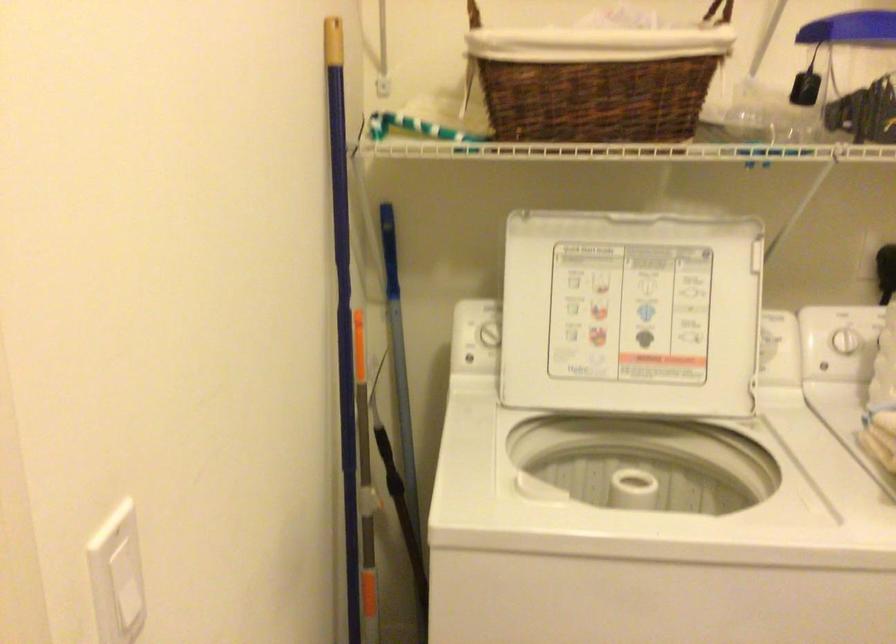
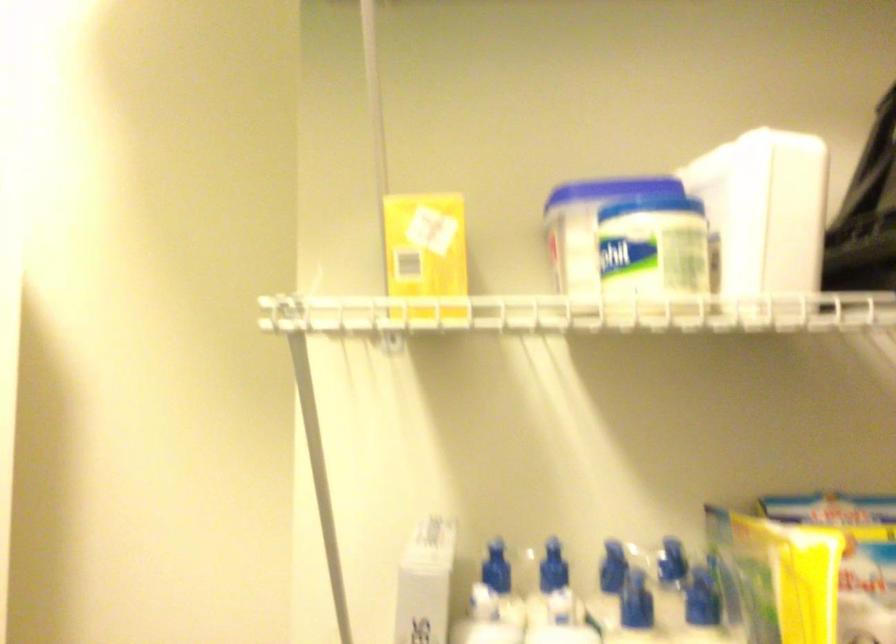
Question: The camera is either moving clockwise (left) or counter-clockwise (right) around the object. The first image is from the beginning of the video and the second image is from the end. Is the camera moving left or right when shooting the video?

Choices:
 (A) Left
 (B) Right

Answer: (A)